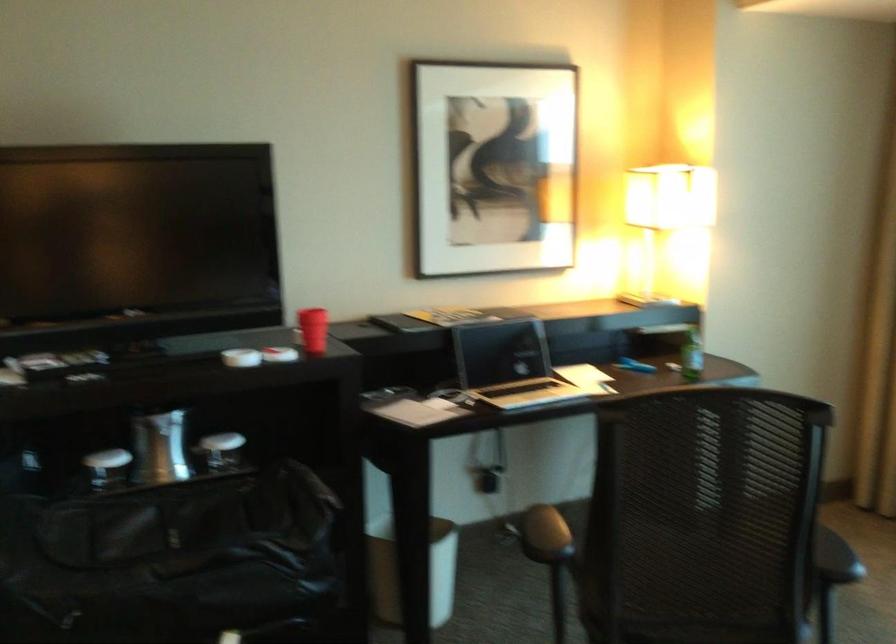
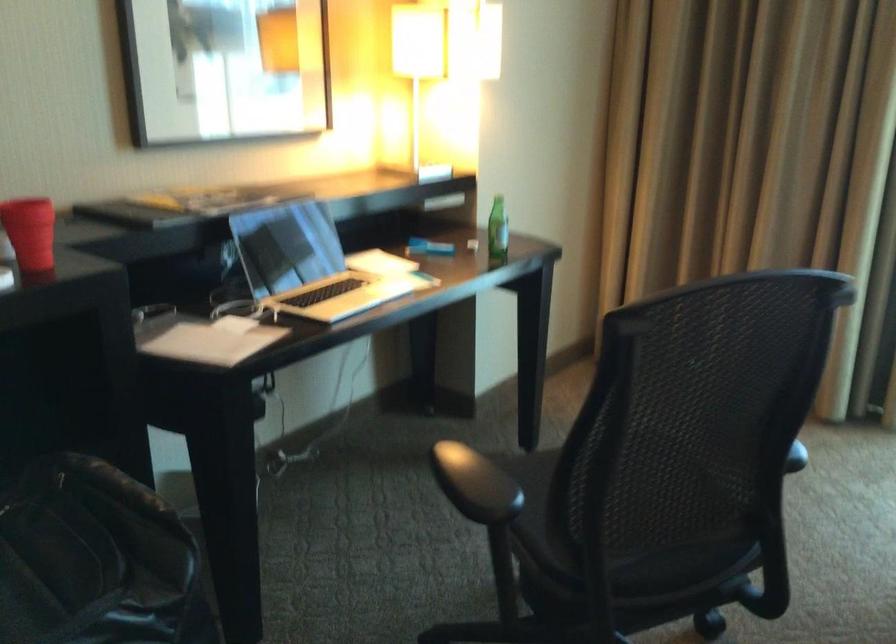
The point at [596,538] is marked in the first image. Where is the corresponding point in the second image?

(558, 480)